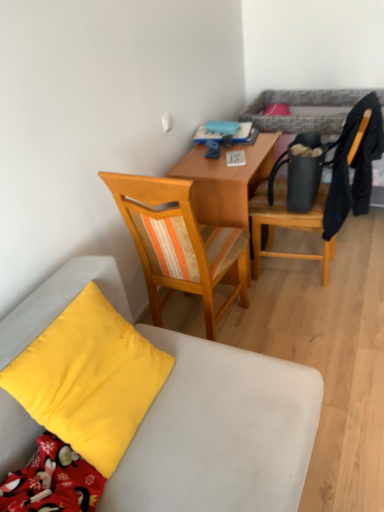
This screenshot has height=512, width=384. In order to click on space that is in front of wooden desk at center in this screenshot , I will do `click(294, 312)`.